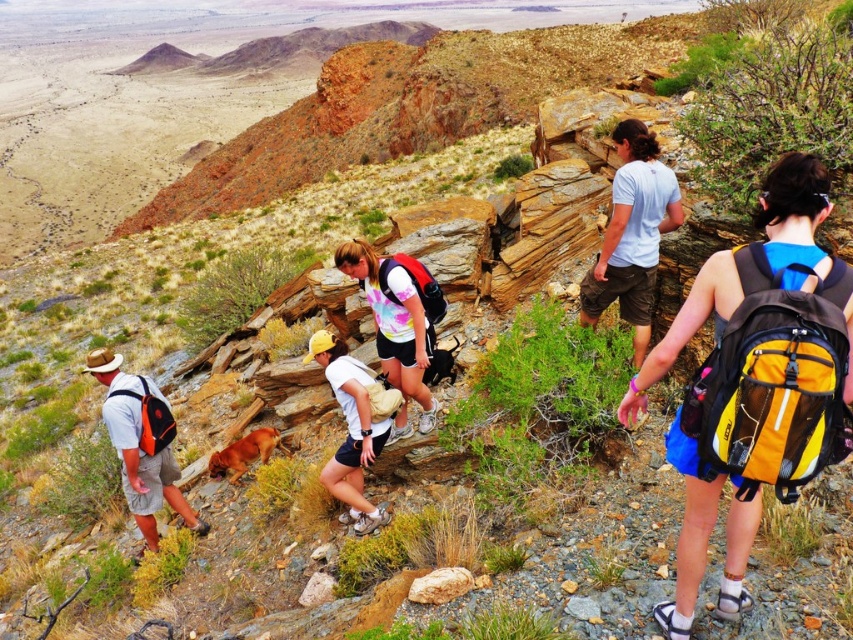
Question: Which object is farther from the camera taking this photo?

Choices:
 (A) white fabric shirt at center
 (B) light blue t-shirt at upper right
 (C) orange fabric backpack at left
 (D) brown furry dog at lower center

Answer: (D)

Question: Is light blue t-shirt at upper right positioned behind brown furry dog at lower center?

Choices:
 (A) yes
 (B) no

Answer: (B)

Question: Which point is farther from the camera taking this photo?

Choices:
 (A) (131, 477)
 (B) (634, 362)
 (C) (398, 384)

Answer: (A)

Question: Does light blue t-shirt at upper right appear over white tie-dye t-shirt at center?

Choices:
 (A) no
 (B) yes

Answer: (B)

Question: Among these objects, which one is farthest from the camera?

Choices:
 (A) white fabric shirt at center
 (B) brown furry dog at lower center

Answer: (B)

Question: Is white tie-dye t-shirt at center behind orange fabric backpack at left?

Choices:
 (A) no
 (B) yes

Answer: (A)